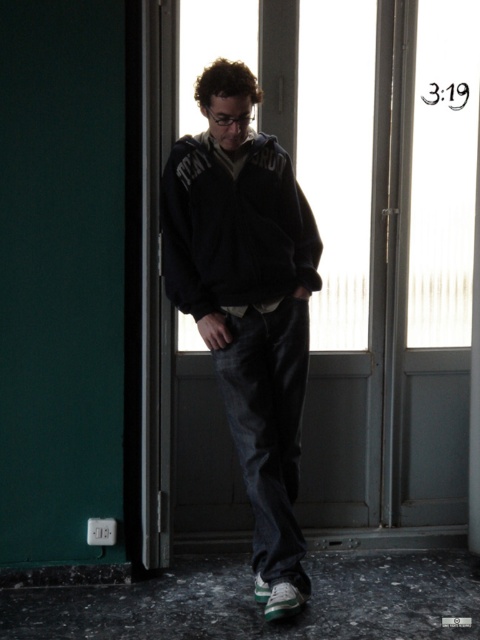
Does transparent glass door at center have a greater height compared to dark blue fleece jacket at center?

Correct, transparent glass door at center is much taller as dark blue fleece jacket at center.

Between transparent glass door at center and dark blue fleece jacket at center, which one appears on the right side from the viewer's perspective?

transparent glass door at center

Between point (219, 26) and point (231, 179), which one is positioned behind?

Positioned behind is point (219, 26).

Locate an element on the screen. Image resolution: width=480 pixels, height=640 pixels. transparent glass door at center is located at coordinates (333, 260).

Between point (338, 1) and point (288, 259), which one is positioned behind?

Point (338, 1)

Does transparent glass door at center come behind dark gray fleece sweatshirt at center?

Yes, it is behind dark gray fleece sweatshirt at center.

Locate an element on the screen. transparent glass door at center is located at coordinates (333, 260).

You are a GUI agent. You are given a task and a screenshot of the screen. Output one action in this format:
    pyautogui.click(x=<x>, y=<y>)
    Task: Click on the transparent glass door at center
    This screenshot has width=480, height=640.
    Given the screenshot: What is the action you would take?
    pyautogui.click(x=333, y=260)

Who is positioned more to the right, dark blue fleece jacket at center or dark gray fleece sweatshirt at center?

dark blue fleece jacket at center

Between dark blue fleece jacket at center and dark gray fleece sweatshirt at center, which one has more height?

Standing taller between the two is dark blue fleece jacket at center.

Where is `dark blue fleece jacket at center`? The width and height of the screenshot is (480, 640). dark blue fleece jacket at center is located at coordinates (248, 305).